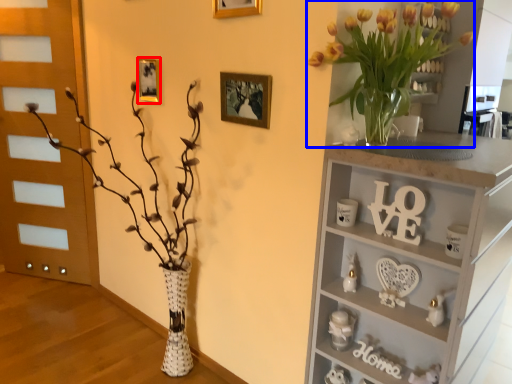
Question: Which object appears closest to the camera in this image, picture frame (highlighted by a red box) or floral arrangement (highlighted by a blue box)?

Choices:
 (A) picture frame
 (B) floral arrangement

Answer: (B)